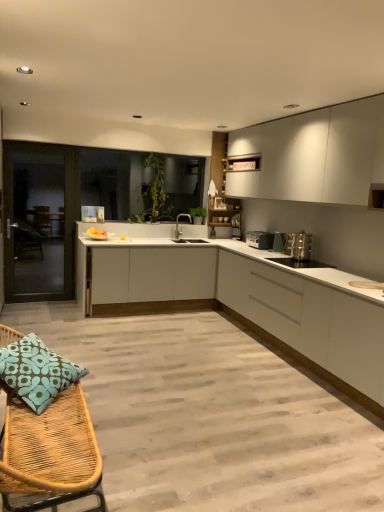
Identify the location of transparent glass door at left. The height and width of the screenshot is (512, 384). (40, 220).

The image size is (384, 512). What do you see at coordinates (36, 372) in the screenshot? I see `blue printed cushion at lower left` at bounding box center [36, 372].

Identify the location of transparent glass door at left. (40, 220).

Is white matte cabinet at center, the 2th cabinetry when ordered from bottom to top, wider than satin nickel faucet at center?

Correct, the width of white matte cabinet at center, the 2th cabinetry when ordered from bottom to top, exceeds that of satin nickel faucet at center.

From a real-world perspective, between white matte cabinet at center, the 2th cabinetry when ordered from bottom to top, and satin nickel faucet at center, who is vertically higher?

satin nickel faucet at center is physically above.

Between white matte cabinet at center, the 2th cabinetry when ordered from bottom to top, and satin nickel faucet at center, which one appears on the right side from the viewer's perspective?

From the viewer's perspective, satin nickel faucet at center appears more on the right side.

Is white matte cabinet at center, the 2th cabinetry when ordered from bottom to top, situated inside satin nickel faucet at center or outside?

white matte cabinet at center, the 2th cabinetry when ordered from bottom to top, is not inside satin nickel faucet at center, it's outside.

Who is more distant, white matte cabinet at center, the 2th cabinetry when ordered from bottom to top, or transparent glass door at left?

Positioned behind is transparent glass door at left.

How different are the orientations of white matte cabinet at center, the 2th cabinetry when ordered from bottom to top, and transparent glass door at left in degrees?

0.00369 degrees separate the facing orientations of white matte cabinet at center, the 2th cabinetry when ordered from bottom to top, and transparent glass door at left.

In the image, there is a white matte cabinet at center, placed as the 2th cabinetry when sorted from top to bottom. Where is `screen door above it (from the image's perspective)`? The image size is (384, 512). screen door above it (from the image's perspective) is located at coordinates (40, 220).

Can you confirm if white matte cabinet at center, placed as the 2th cabinetry when sorted from top to bottom, is wider than transparent glass door at left?

Yes, white matte cabinet at center, placed as the 2th cabinetry when sorted from top to bottom, is wider than transparent glass door at left.

Considering the sizes of transparent glass door at left and white matte cabinet at upper right, which is counted as the 1th cabinetry, starting from the top, in the image, is transparent glass door at left wider or thinner than white matte cabinet at upper right, which is counted as the 1th cabinetry, starting from the top,?

Considering their sizes, transparent glass door at left looks slimmer than white matte cabinet at upper right, which is counted as the 1th cabinetry, starting from the top.

Is transparent glass door at left completely or partially outside of white matte cabinet at upper right, marked as the 3th cabinetry in a bottom-to-top arrangement?

Yes, transparent glass door at left is outside of white matte cabinet at upper right, marked as the 3th cabinetry in a bottom-to-top arrangement.

Does transparent glass door at left turn towards white matte cabinet at upper right, which is counted as the 1th cabinetry, starting from the top?

No, transparent glass door at left is not aimed at white matte cabinet at upper right, which is counted as the 1th cabinetry, starting from the top.

Is transparent glass door at left at the right side of white matte cabinet at upper right, marked as the 3th cabinetry in a bottom-to-top arrangement?

Incorrect, transparent glass door at left is not on the right side of white matte cabinet at upper right, marked as the 3th cabinetry in a bottom-to-top arrangement.

Which is less distant, (70, 376) or (288, 240)?

Point (70, 376) appears to be closer to the viewer than point (288, 240).

Which of these two, blue printed cushion at lower left or satin silver toaster at right, which appears as the 2th appliance when viewed from the back, is smaller?

Smaller between the two is satin silver toaster at right, which appears as the 2th appliance when viewed from the back.

Considering the sizes of objects blue printed cushion at lower left and satin silver toaster at right, which appears as the 2th appliance when viewed from the back, in the image provided, who is wider, blue printed cushion at lower left or satin silver toaster at right, which appears as the 2th appliance when viewed from the back,?

Wider between the two is blue printed cushion at lower left.

From the image's perspective, who appears lower, satin silver toaster at right, which appears as the first appliance when viewed from the front, or satin nickel faucet at center?

satin silver toaster at right, which appears as the first appliance when viewed from the front, from the image's perspective.

Consider the image. Which is closer to the camera, (298, 257) or (177, 234)?

Point (298, 257) is closer to the camera than point (177, 234).

From a real-world perspective, is satin silver toaster at right, which appears as the first appliance when viewed from the front, on top of satin nickel faucet at center?

Incorrect, from a real-world perspective, satin silver toaster at right, which appears as the first appliance when viewed from the front, is lower than satin nickel faucet at center.

Is satin silver toaster at right, which appears as the first appliance when viewed from the front, to the left or to the right of satin nickel faucet at center in the image?

From the image, it's evident that satin silver toaster at right, which appears as the first appliance when viewed from the front, is to the right of satin nickel faucet at center.

Looking at this image, is satin silver toaster at right, which ranks as the second appliance in front-to-back order, aimed at white matte cabinet at upper right, which is counted as the 1th cabinetry, starting from the top?

No, satin silver toaster at right, which ranks as the second appliance in front-to-back order, does not turn towards white matte cabinet at upper right, which is counted as the 1th cabinetry, starting from the top.

Does satin silver toaster at right, which ranks as the second appliance in front-to-back order, have a lesser width compared to white matte cabinet at upper right, marked as the 3th cabinetry in a bottom-to-top arrangement?

Yes, satin silver toaster at right, which ranks as the second appliance in front-to-back order, is thinner than white matte cabinet at upper right, marked as the 3th cabinetry in a bottom-to-top arrangement.

Is satin silver toaster at right, which appears as the 2th appliance when viewed from the back, smaller than white matte cabinet at upper right, marked as the 3th cabinetry in a bottom-to-top arrangement?

Indeed, satin silver toaster at right, which appears as the 2th appliance when viewed from the back, has a smaller size compared to white matte cabinet at upper right, marked as the 3th cabinetry in a bottom-to-top arrangement.

Who is smaller, satin silver toaster at right, which appears as the 2th appliance when viewed from the back, or woven wood bench at lower left?

With smaller size is satin silver toaster at right, which appears as the 2th appliance when viewed from the back.

Is satin silver toaster at right, which ranks as the second appliance in front-to-back order, oriented towards woven wood bench at lower left?

No, satin silver toaster at right, which ranks as the second appliance in front-to-back order, is not facing towards woven wood bench at lower left.

From a real-world perspective, which object rests below the other?

woven wood bench at lower left.

At what (x,y) coordinates should I click in order to perform the action: click on tap above the white matte cabinet at center, the 2th cabinetry when ordered from bottom to top (from the image's perspective). Please return your answer as a coordinate pair (x, y). Looking at the image, I should click on point(178,220).

From the image's perspective, count 1st cabinetrys downward from the transparent glass door at left and point to it. Please provide its 2D coordinates.

[(152, 279)]

Based on their spatial positions, is satin silver toaster at right, which appears as the first appliance when viewed from the front, or satin silver toaster at right, which ranks as the second appliance in front-to-back order, closer to white matte cabinet at upper right, which is counted as the 1th cabinetry, starting from the top?

satin silver toaster at right, which appears as the first appliance when viewed from the front.

Estimate the real-world distances between objects in this image. Which object is further from satin silver toaster at right, which ranks as the second appliance in front-to-back order, woven wood bench at lower left or satin nickel faucet at center?

Among the two, woven wood bench at lower left is located further to satin silver toaster at right, which ranks as the second appliance in front-to-back order.

Estimate the real-world distances between objects in this image. Which object is closer to transparent glass door at left, satin nickel faucet at center or silver metallic toaster at center, which is the third appliance in front-to-back order?

The object closer to transparent glass door at left is satin nickel faucet at center.

Which object lies further to the anchor point transparent glass door at left, woven wood bench at lower left or white matte cabinet at center, the 2th cabinetry when ordered from bottom to top?

Among the two, woven wood bench at lower left is located further to transparent glass door at left.

When comparing their distances from white matte cabinet at right, arranged as the 1th cabinetry when ordered from the bottom, does woven wood bench at lower left or white matte cabinet at center, the 2th cabinetry when ordered from bottom to top, seem closer?

white matte cabinet at center, the 2th cabinetry when ordered from bottom to top, is closer to white matte cabinet at right, arranged as the 1th cabinetry when ordered from the bottom.

Looking at the image, which one is located further to satin silver toaster at right, which ranks as the second appliance in front-to-back order, blue printed cushion at lower left or white matte cabinet at right, arranged as the 1th cabinetry when ordered from the bottom?

blue printed cushion at lower left.

From the image, which object appears to be farther from white matte cabinet at right, which ranks as the third cabinetry in top-to-bottom order, silver metallic toaster at center, which is the third appliance in front-to-back order, or satin silver toaster at right, which appears as the 2th appliance when viewed from the back?

silver metallic toaster at center, which is the third appliance in front-to-back order, is further to white matte cabinet at right, which ranks as the third cabinetry in top-to-bottom order.

Estimate the real-world distances between objects in this image. Which object is closer to blue printed cushion at lower left, white matte cabinet at center, the 2th cabinetry when ordered from bottom to top, or satin silver toaster at right, which appears as the first appliance when viewed from the front?

white matte cabinet at center, the 2th cabinetry when ordered from bottom to top, is positioned closer to the anchor blue printed cushion at lower left.

Locate an element on the screen. pillow between woven wood bench at lower left and satin silver toaster at right, which appears as the first appliance when viewed from the front, from front to back is located at coordinates (36, 372).

At what (x,y) coordinates should I click in order to perform the action: click on appliance between satin nickel faucet at center and satin silver toaster at right, which ranks as the second appliance in front-to-back order, from left to right. Please return your answer as a coordinate pair (x, y). This screenshot has height=512, width=384. Looking at the image, I should click on (260, 239).

Where is `pillow between woven wood bench at lower left and white matte cabinet at center, placed as the 2th cabinetry when sorted from top to bottom, from front to back`? pillow between woven wood bench at lower left and white matte cabinet at center, placed as the 2th cabinetry when sorted from top to bottom, from front to back is located at coordinates (36, 372).

I want to click on pillow located between transparent glass door at left and white matte cabinet at upper right, marked as the 3th cabinetry in a bottom-to-top arrangement, in the left-right direction, so 36,372.